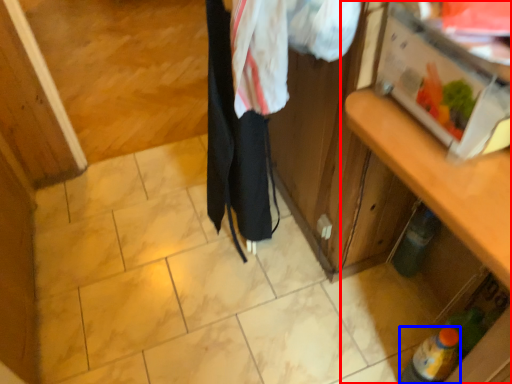
Question: Which point is further to the camera, cabinetry (highlighted by a red box) or bottle (highlighted by a blue box)?

Choices:
 (A) cabinetry
 (B) bottle

Answer: (B)